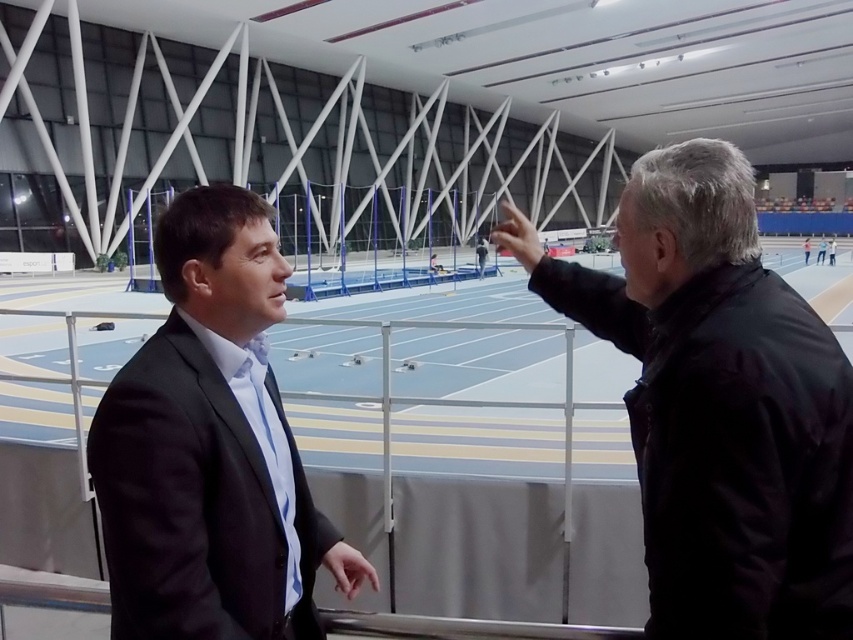
Is black matte jacket at right behind matte black suit at center?

No, it is in front of matte black suit at center.

Can you confirm if black matte jacket at right is taller than matte black suit at center?

Correct, black matte jacket at right is much taller as matte black suit at center.

In order to click on black matte jacket at right in this screenshot , I will do `click(718, 404)`.

Does matte black suit at center appear over blue silk tie at left?

No.

This screenshot has width=853, height=640. Describe the element at coordinates (210, 448) in the screenshot. I see `matte black suit at center` at that location.

Who is more distant from viewer, (270, 300) or (265, 461)?

The point (265, 461) is more distant.

Find the location of a particular element. The height and width of the screenshot is (640, 853). matte black suit at center is located at coordinates (210, 448).

Which of these two, black matte jacket at right or blue silk tie at left, stands taller?

Standing taller between the two is black matte jacket at right.

Between point (699, 192) and point (271, 424), which one is positioned in front?

Point (699, 192)

This screenshot has height=640, width=853. What do you see at coordinates (718, 404) in the screenshot?
I see `black matte jacket at right` at bounding box center [718, 404].

Locate an element on the screen. black matte jacket at right is located at coordinates (718, 404).